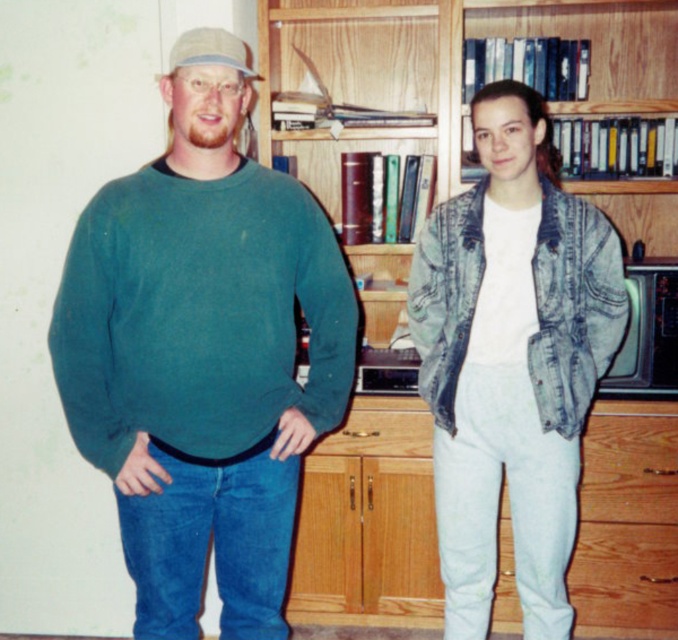
Is denim jacket at center taller than wooden bookcase at center?

Correct, denim jacket at center is much taller as wooden bookcase at center.

Does point (518, 266) come in front of point (595, 1)?

Yes, point (518, 266) is in front of point (595, 1).

Where is `denim jacket at center`? The width and height of the screenshot is (678, 640). denim jacket at center is located at coordinates (511, 360).

Who is more distant from viewer, [233,326] or [593,340]?

Positioned behind is point [593,340].

You are a GUI agent. You are given a task and a screenshot of the screen. Output one action in this format:
    pyautogui.click(x=<x>, y=<y>)
    Task: Click on the teal matte sweater at left
    This screenshot has width=678, height=640.
    Given the screenshot: What is the action you would take?
    pyautogui.click(x=201, y=353)

Between point (98, 273) and point (494, 161), which one is positioned in front?

Positioned in front is point (98, 273).

I want to click on teal matte sweater at left, so click(201, 353).

Is point (277, 234) positioned after point (418, 49)?

No, it is not.

Is teal matte sweater at left wider than wooden bookcase at center?

No.

Find the location of a particular element. teal matte sweater at left is located at coordinates (201, 353).